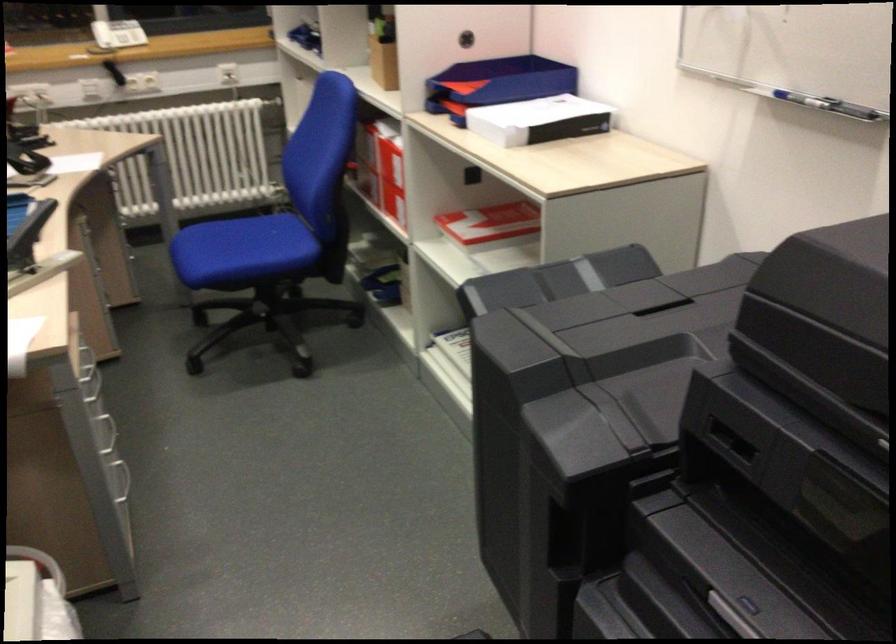
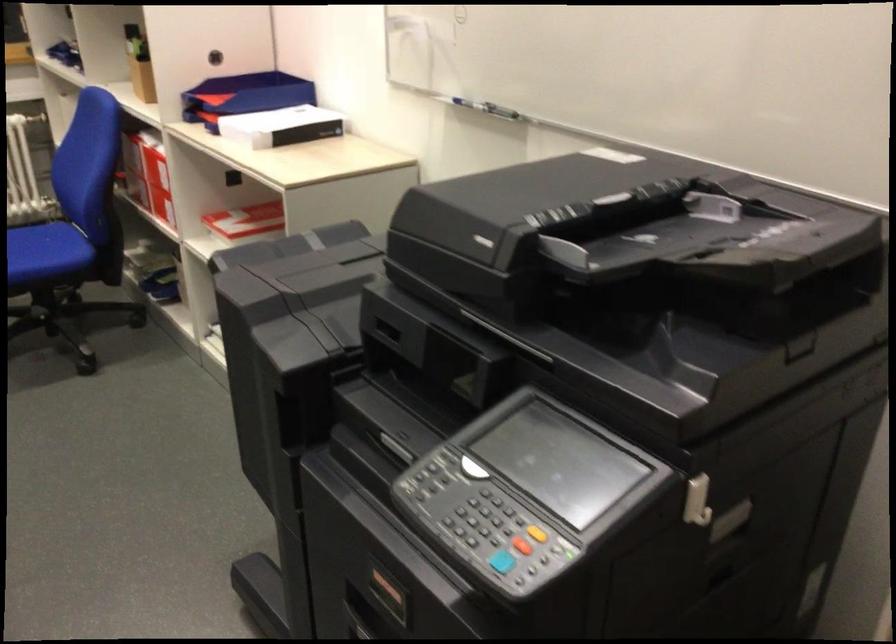
The point at (382,165) is marked in the first image. Where is the corresponding point in the second image?

(148, 175)